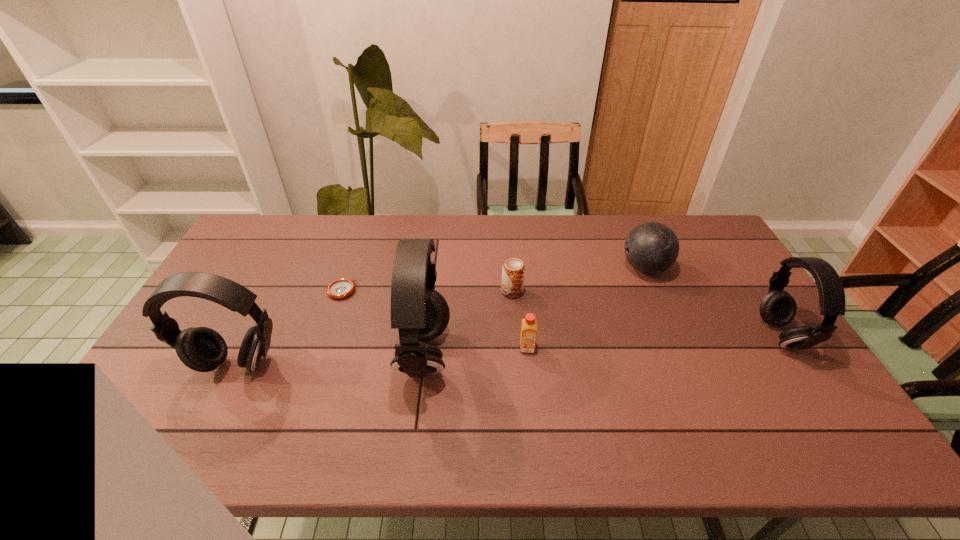
The image size is (960, 540). Find the location of `blank space located on the grip area of the bowling ball`. blank space located on the grip area of the bowling ball is located at coordinates point(585,268).

Locate an element on the screen. Image resolution: width=960 pixels, height=540 pixels. free spot located 0.370m on the back of the shortest object is located at coordinates (x=367, y=216).

You are a GUI agent. You are given a task and a screenshot of the screen. Output one action in this format:
    pyautogui.click(x=<x>, y=<y>)
    Task: Click on the vacant space located 0.230m on the left of the beer can
    This screenshot has width=960, height=540.
    Given the screenshot: What is the action you would take?
    pyautogui.click(x=428, y=292)

Find the location of a particular element. vacant area situated 0.080m on the front and back of the orange juice is located at coordinates (530, 379).

You are a GUI agent. You are given a task and a screenshot of the screen. Output one action in this format:
    pyautogui.click(x=<x>, y=<y>)
    Task: Click on the object present at the far edge
    The width and height of the screenshot is (960, 540).
    Given the screenshot: What is the action you would take?
    pyautogui.click(x=651, y=248)

This screenshot has width=960, height=540. I want to click on object that is at the near edge, so click(x=420, y=313).

Locate an element on the screen. object that is at the left edge is located at coordinates [x=202, y=349].

At what (x,y) coordinates should I click in order to perform the action: click on object situated at the right edge. Please return your answer as a coordinate pair (x, y). Image resolution: width=960 pixels, height=540 pixels. Looking at the image, I should click on (778, 308).

The image size is (960, 540). In order to click on free space at the far edge of the desktop in this screenshot , I will do `click(338, 235)`.

This screenshot has width=960, height=540. Identify the location of vacant space at the left edge of the desktop. (253, 269).